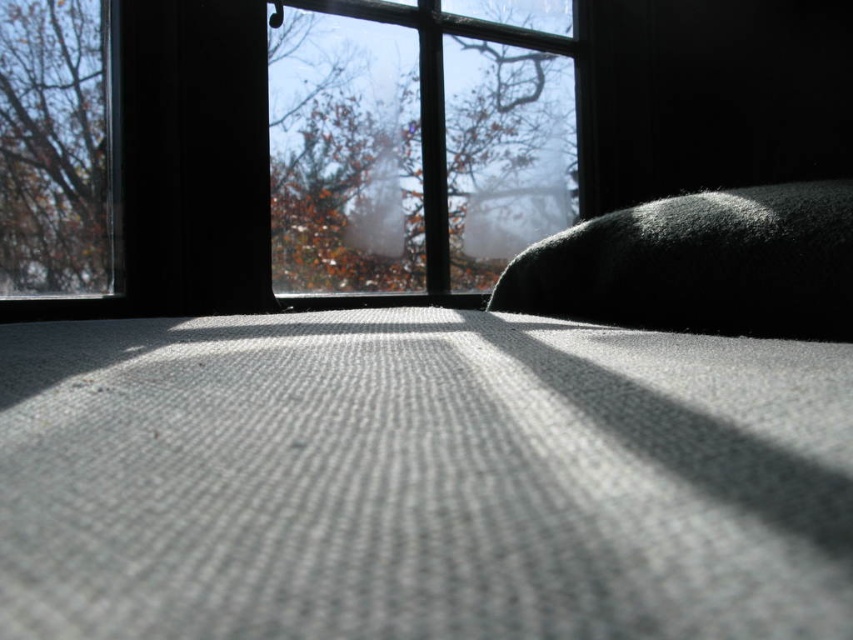
You are standing in a room and want to look outside through the transparent glass window at upper center. Where should you direct your gaze to see the view beyond the window?

You should direct your gaze to the transparent glass window at upper center located at point (287, 154) to see the view beyond the window.